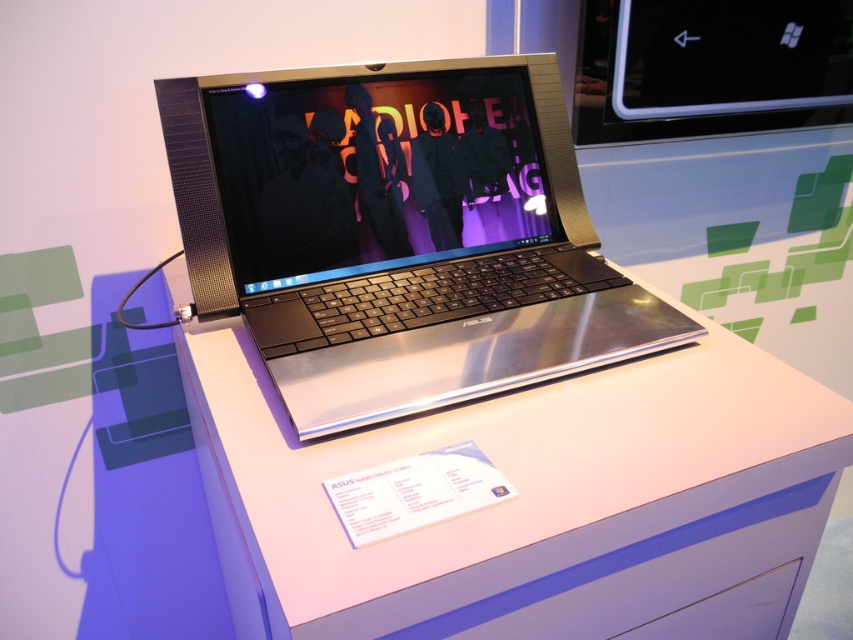
What do you see at coordinates (531, 502) in the screenshot?
I see `silver metallic table at center` at bounding box center [531, 502].

Can you confirm if silver metallic table at center is positioned to the left of silver metallic laptop at center?

Indeed, silver metallic table at center is positioned on the left side of silver metallic laptop at center.

You are a GUI agent. You are given a task and a screenshot of the screen. Output one action in this format:
    pyautogui.click(x=<x>, y=<y>)
    Task: Click on the silver metallic table at center
    
    Given the screenshot: What is the action you would take?
    pyautogui.click(x=531, y=502)

This screenshot has height=640, width=853. I want to click on silver metallic table at center, so click(x=531, y=502).

Is silver metallic table at center below matte purple drawer at lower center?

Actually, silver metallic table at center is above matte purple drawer at lower center.

Consider the image. Who is higher up, silver metallic table at center or matte purple drawer at lower center?

Positioned higher is silver metallic table at center.

Who is more distant from viewer, [793,563] or [705,538]?

The point [793,563] is behind.

At what (x,y) coordinates should I click in order to perform the action: click on silver metallic table at center. Please return your answer as a coordinate pair (x, y). The image size is (853, 640). Looking at the image, I should click on (531, 502).

Is silver metallic laptop at center below matte purple drawer at lower center?

Incorrect, silver metallic laptop at center is not positioned below matte purple drawer at lower center.

Is silver metallic laptop at center in front of matte purple drawer at lower center?

No, it is behind matte purple drawer at lower center.

Between point (437, 124) and point (703, 595), which one is positioned behind?

Positioned behind is point (437, 124).

The image size is (853, 640). In order to click on silver metallic laptop at center in this screenshot , I will do `click(398, 234)`.